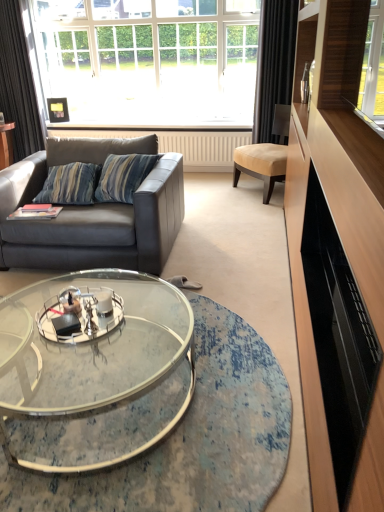
Question: Is beige fabric chair at center turned away from clear glass coffee table at center?

Choices:
 (A) no
 (B) yes

Answer: (A)

Question: Can you confirm if beige fabric chair at center is positioned to the left of clear glass coffee table at center?

Choices:
 (A) yes
 (B) no

Answer: (B)

Question: Is beige fabric chair at center located outside clear glass coffee table at center?

Choices:
 (A) no
 (B) yes

Answer: (B)

Question: Is beige fabric chair at center bigger than clear glass coffee table at center?

Choices:
 (A) no
 (B) yes

Answer: (A)

Question: Does beige fabric chair at center contain clear glass coffee table at center?

Choices:
 (A) no
 (B) yes

Answer: (A)

Question: Visually, is beige fabric chair at center positioned to the left or to the right of white glass window at upper center?

Choices:
 (A) left
 (B) right

Answer: (B)

Question: From the image's perspective, is beige fabric chair at center located above or below white glass window at upper center?

Choices:
 (A) below
 (B) above

Answer: (A)

Question: Would you say beige fabric chair at center is inside or outside white glass window at upper center?

Choices:
 (A) inside
 (B) outside

Answer: (B)

Question: Is beige fabric chair at center taller or shorter than white glass window at upper center?

Choices:
 (A) tall
 (B) short

Answer: (B)

Question: Is black fabric curtain at right, placed as the second curtain when sorted from left to right, inside or outside of black glossy entertainment center at right?

Choices:
 (A) inside
 (B) outside

Answer: (B)

Question: From a real-world perspective, is black fabric curtain at right, placed as the second curtain when sorted from left to right, positioned above or below black glossy entertainment center at right?

Choices:
 (A) above
 (B) below

Answer: (A)

Question: In terms of width, does black fabric curtain at right, placed as the second curtain when sorted from left to right, look wider or thinner when compared to black glossy entertainment center at right?

Choices:
 (A) thin
 (B) wide

Answer: (A)

Question: Considering the positions of black fabric curtain at right, the first curtain viewed from the right, and black glossy entertainment center at right in the image, is black fabric curtain at right, the first curtain viewed from the right, taller or shorter than black glossy entertainment center at right?

Choices:
 (A) tall
 (B) short

Answer: (A)

Question: Considering the positions of point (261, 129) and point (160, 301), is point (261, 129) closer or farther from the camera than point (160, 301)?

Choices:
 (A) closer
 (B) farther

Answer: (B)

Question: Considering the positions of black fabric curtain at right, the first curtain viewed from the right, and clear glass coffee table at center in the image, is black fabric curtain at right, the first curtain viewed from the right, bigger or smaller than clear glass coffee table at center?

Choices:
 (A) big
 (B) small

Answer: (B)